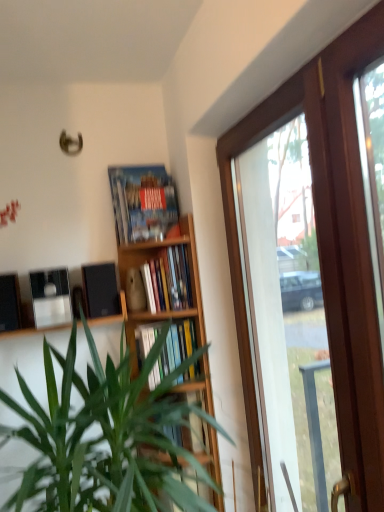
This screenshot has width=384, height=512. Identify the location of matte black shelf at center, which is the 2th shelf from right to left. (112, 315).

This screenshot has width=384, height=512. What do you see at coordinates (167, 280) in the screenshot? I see `hardcover books at center, acting as the second book starting from the top` at bounding box center [167, 280].

What is the approximate height of hardcover books at center, acting as the second book starting from the top?

The height of hardcover books at center, acting as the second book starting from the top, is 11.45 inches.

Identify the location of black matte speaker at lower left, which is the first loudspeaker from right to left. (100, 290).

Measure the distance from wooden frame at right to hardcover book at upper center, which is counted as the first book, starting from the top.

The distance of wooden frame at right from hardcover book at upper center, which is counted as the first book, starting from the top, is 28.28 inches.

Which is more to the left, wooden frame at right or hardcover book at upper center, which appears as the 3th book when ordered from the bottom?

Positioned to the left is hardcover book at upper center, which appears as the 3th book when ordered from the bottom.

Does wooden frame at right come behind hardcover book at upper center, which appears as the 3th book when ordered from the bottom?

No, the depth of wooden frame at right is less than that of hardcover book at upper center, which appears as the 3th book when ordered from the bottom.

Are wooden frame at right and hardcover book at upper center, which appears as the 3th book when ordered from the bottom, located far from each other?

wooden frame at right is actually quite close to hardcover book at upper center, which appears as the 3th book when ordered from the bottom.

Is hardcover book at center, marked as the 1th book in a bottom-to-top arrangement, located within wooden bookshelf at center, which appears as the first shelf when ordered from the bottom?

No, wooden bookshelf at center, which appears as the first shelf when ordered from the bottom, does not contain hardcover book at center, marked as the 1th book in a bottom-to-top arrangement.

In terms of size, does wooden bookshelf at center, which is the 2th shelf in left-to-right order, appear bigger or smaller than hardcover book at center, which is the 3th book from top to bottom?

Considering their sizes, wooden bookshelf at center, which is the 2th shelf in left-to-right order, takes up less space than hardcover book at center, which is the 3th book from top to bottom.

Which is closer to the camera, (164, 455) or (178, 331)?

Point (164, 455) appears to be farther away from the viewer than point (178, 331).

Is wooden bookshelf at center, which appears as the first shelf when ordered from the bottom, touching hardcover book at center, marked as the 1th book in a bottom-to-top arrangement?

There is a gap between wooden bookshelf at center, which appears as the first shelf when ordered from the bottom, and hardcover book at center, marked as the 1th book in a bottom-to-top arrangement.

Does black matte speaker at left, which ranks as the 2th loudspeaker in right-to-left order, have a greater width compared to wooden bookshelf at center, marked as the second shelf in a top-to-bottom arrangement?

In fact, black matte speaker at left, which ranks as the 2th loudspeaker in right-to-left order, might be narrower than wooden bookshelf at center, marked as the second shelf in a top-to-bottom arrangement.

Which point is more distant from viewer, [3,328] or [158,457]?

The point [158,457] is farther.

Looking at this image, considering the relative sizes of black matte speaker at left, which ranks as the 2th loudspeaker in right-to-left order, and wooden bookshelf at center, which is the 2th shelf in left-to-right order, in the image provided, is black matte speaker at left, which ranks as the 2th loudspeaker in right-to-left order, shorter than wooden bookshelf at center, which is the 2th shelf in left-to-right order,?

Yes, black matte speaker at left, which ranks as the 2th loudspeaker in right-to-left order, is shorter than wooden bookshelf at center, which is the 2th shelf in left-to-right order.

Could you tell me if green leafy plant at center is facing hardcover books at center, which appears as the 2th book when ordered from the bottom?

No, green leafy plant at center is not facing towards hardcover books at center, which appears as the 2th book when ordered from the bottom.

Between green leafy plant at center and hardcover books at center, which appears as the 2th book when ordered from the bottom, which one has larger size?

green leafy plant at center.

Considering the positions of objects green leafy plant at center and hardcover books at center, acting as the second book starting from the top, in the image provided, who is more to the left, green leafy plant at center or hardcover books at center, acting as the second book starting from the top,?

Positioned to the left is green leafy plant at center.

Which point is more distant from viewer, [73,428] or [187,285]?

Positioned behind is point [187,285].

How many degrees apart are the facing directions of black matte speaker at lower left, which is the first loudspeaker from right to left, and hardcover book at center, marked as the 1th book in a bottom-to-top arrangement?

The angular difference between black matte speaker at lower left, which is the first loudspeaker from right to left, and hardcover book at center, marked as the 1th book in a bottom-to-top arrangement, is 3.3 degrees.

Measure the distance between black matte speaker at lower left, which is the first loudspeaker from right to left, and hardcover book at center, marked as the 1th book in a bottom-to-top arrangement.

11.13 inches.

From a real-world perspective, who is located higher, black matte speaker at lower left, which is the first loudspeaker from right to left, or hardcover book at center, marked as the 1th book in a bottom-to-top arrangement?

black matte speaker at lower left, which is the first loudspeaker from right to left, is physically above.

Is the surface of black matte speaker at lower left, which is the second loudspeaker from left to right, in direct contact with hardcover book at center, which is the 3th book from top to bottom?

There is a gap between black matte speaker at lower left, which is the second loudspeaker from left to right, and hardcover book at center, which is the 3th book from top to bottom.

Does point (144, 174) appear closer or farther from the camera than point (355, 383)?

Point (144, 174) is farther from the camera than point (355, 383).

From the image's perspective, between hardcover book at upper center, which appears as the 3th book when ordered from the bottom, and wooden frame at right, which one is located above?

hardcover book at upper center, which appears as the 3th book when ordered from the bottom, appears higher in the image.

I want to click on window lying on the right of hardcover book at upper center, which is counted as the first book, starting from the top, so click(x=327, y=248).

Is matte black shelf at center, the 1th shelf when ordered from left to right, at the right side of wooden frame at right?

No, matte black shelf at center, the 1th shelf when ordered from left to right, is not to the right of wooden frame at right.

Which is nearer, (124, 302) or (328, 169)?

Clearly, point (124, 302) is more distant from the camera than point (328, 169).

Based on the photo, can you confirm if matte black shelf at center, the first shelf when ordered from top to bottom, is taller than wooden frame at right?

No, matte black shelf at center, the first shelf when ordered from top to bottom, is not taller than wooden frame at right.

Considering the sizes of objects matte black shelf at center, the 1th shelf when ordered from left to right, and wooden frame at right in the image provided, who is wider, matte black shelf at center, the 1th shelf when ordered from left to right, or wooden frame at right?

With larger width is matte black shelf at center, the 1th shelf when ordered from left to right.

This screenshot has width=384, height=512. Identify the location of book that is the 3rd one when counting leftward from the wooden frame at right. (142, 202).

Where is `the 1st shelf in front of the hardcover book at center, which is the 3th book from top to bottom`? The height and width of the screenshot is (512, 384). the 1st shelf in front of the hardcover book at center, which is the 3th book from top to bottom is located at coordinates (156, 455).

When comparing their distances from hardcover book at upper center, which is counted as the first book, starting from the top, does wooden bookcase at center or hardcover book at center, marked as the 1th book in a bottom-to-top arrangement, seem further?

The object further to hardcover book at upper center, which is counted as the first book, starting from the top, is hardcover book at center, marked as the 1th book in a bottom-to-top arrangement.

Estimate the real-world distances between objects in this image. Which object is further from hardcover book at upper center, which appears as the 3th book when ordered from the bottom, wooden frame at right or wooden bookshelf at center, acting as the first shelf starting from the right?

wooden bookshelf at center, acting as the first shelf starting from the right, lies further to hardcover book at upper center, which appears as the 3th book when ordered from the bottom, than the other object.

From the image, which object appears to be nearer to hardcover book at center, which is the 3th book from top to bottom, wooden bookshelf at center, which is the 2th shelf in left-to-right order, or wooden frame at right?

wooden bookshelf at center, which is the 2th shelf in left-to-right order, is positioned closer to the anchor hardcover book at center, which is the 3th book from top to bottom.

When comparing their distances from black matte speaker at lower left, which is the second loudspeaker from left to right, does hardcover book at center, marked as the 1th book in a bottom-to-top arrangement, or wooden bookshelf at center, which is the 2th shelf in left-to-right order, seem further?

The object further to black matte speaker at lower left, which is the second loudspeaker from left to right, is wooden bookshelf at center, which is the 2th shelf in left-to-right order.

Which object lies further to the anchor point black matte speaker at lower left, which is the first loudspeaker from right to left, hardcover book at upper center, which is counted as the first book, starting from the top, or black matte speaker at left, which ranks as the 2th loudspeaker in right-to-left order?

Based on the image, black matte speaker at left, which ranks as the 2th loudspeaker in right-to-left order, appears to be further to black matte speaker at lower left, which is the first loudspeaker from right to left.

Which object lies nearer to the anchor point wooden bookcase at center, wooden frame at right or black matte speaker at lower left, which is the second loudspeaker from left to right?

black matte speaker at lower left, which is the second loudspeaker from left to right, is closer to wooden bookcase at center.

Considering their positions, is wooden bookshelf at center, which appears as the first shelf when ordered from the bottom, positioned further to green leafy plant at center than wooden frame at right?

wooden frame at right lies further to green leafy plant at center than the other object.

Considering their positions, is black matte speaker at left, which ranks as the 2th loudspeaker in right-to-left order, positioned further to hardcover book at center, marked as the 1th book in a bottom-to-top arrangement, than wooden bookcase at center?

The object further to hardcover book at center, marked as the 1th book in a bottom-to-top arrangement, is black matte speaker at left, which ranks as the 2th loudspeaker in right-to-left order.

Where is `bookcase between hardcover book at upper center, which is counted as the first book, starting from the top, and wooden bookshelf at center, acting as the first shelf starting from the right, from top to bottom`? This screenshot has width=384, height=512. bookcase between hardcover book at upper center, which is counted as the first book, starting from the top, and wooden bookshelf at center, acting as the first shelf starting from the right, from top to bottom is located at coordinates (157, 263).

The image size is (384, 512). Find the location of `book that lies between hardcover book at upper center, which appears as the 3th book when ordered from the bottom, and black matte speaker at lower left, which is the first loudspeaker from right to left, from top to bottom`. book that lies between hardcover book at upper center, which appears as the 3th book when ordered from the bottom, and black matte speaker at lower left, which is the first loudspeaker from right to left, from top to bottom is located at coordinates (167, 280).

Where is `loudspeaker between black matte speaker at left, the first loudspeaker positioned from the left, and hardcover book at center, which is the 3th book from top to bottom, in the horizontal direction`? The height and width of the screenshot is (512, 384). loudspeaker between black matte speaker at left, the first loudspeaker positioned from the left, and hardcover book at center, which is the 3th book from top to bottom, in the horizontal direction is located at coordinates click(x=100, y=290).

Where is `loudspeaker between green leafy plant at center and wooden bookcase at center along the z-axis`? This screenshot has height=512, width=384. loudspeaker between green leafy plant at center and wooden bookcase at center along the z-axis is located at coordinates (10, 303).